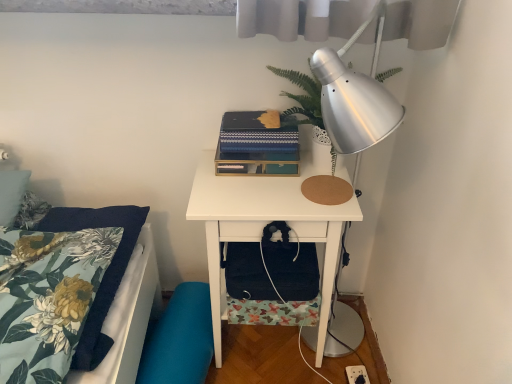
The image size is (512, 384). I want to click on vacant point above blue textured book at center (from a real-world perspective), so click(x=256, y=117).